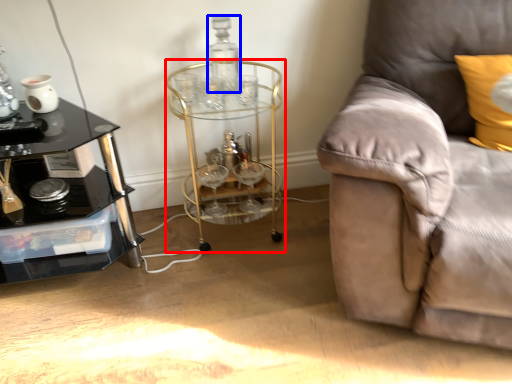
Question: Among these objects, which one is farthest to the camera, round table (highlighted by a red box) or bottle (highlighted by a blue box)?

Choices:
 (A) round table
 (B) bottle

Answer: (B)